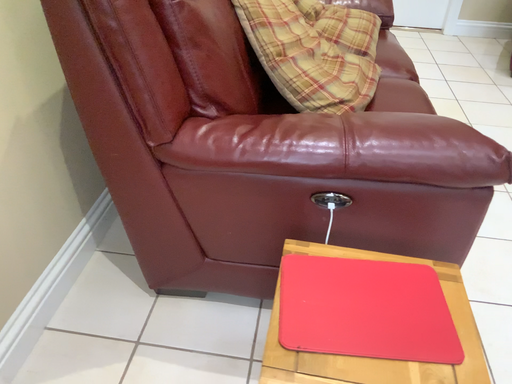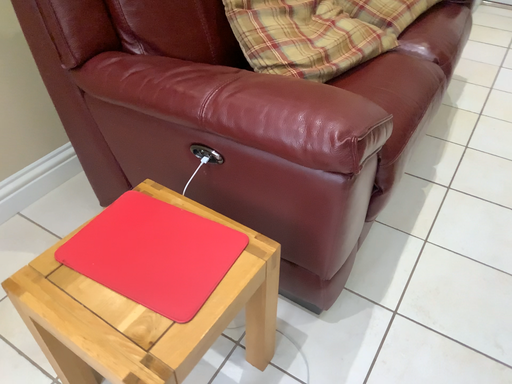
Question: Which way did the camera rotate in the video?

Choices:
 (A) rotated left
 (B) rotated right

Answer: (A)